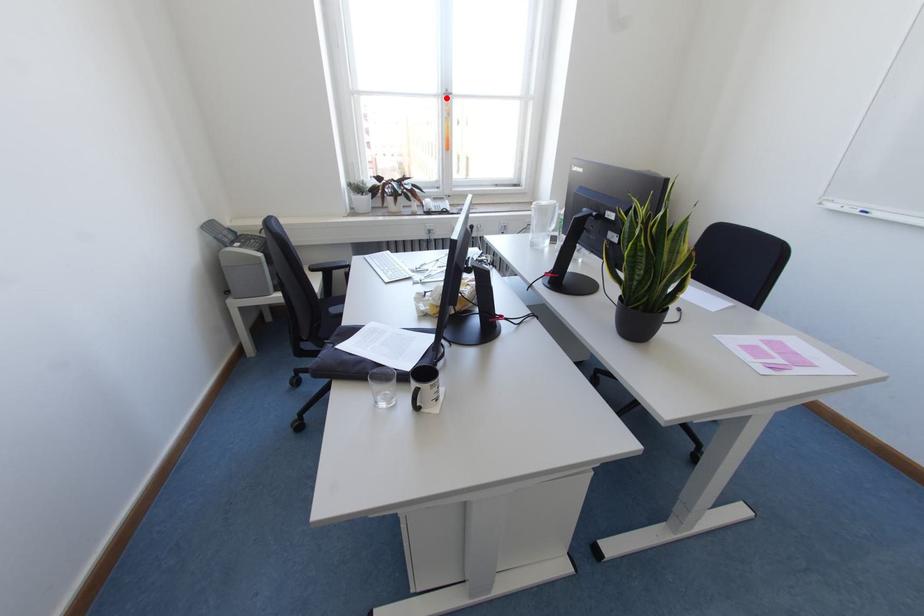
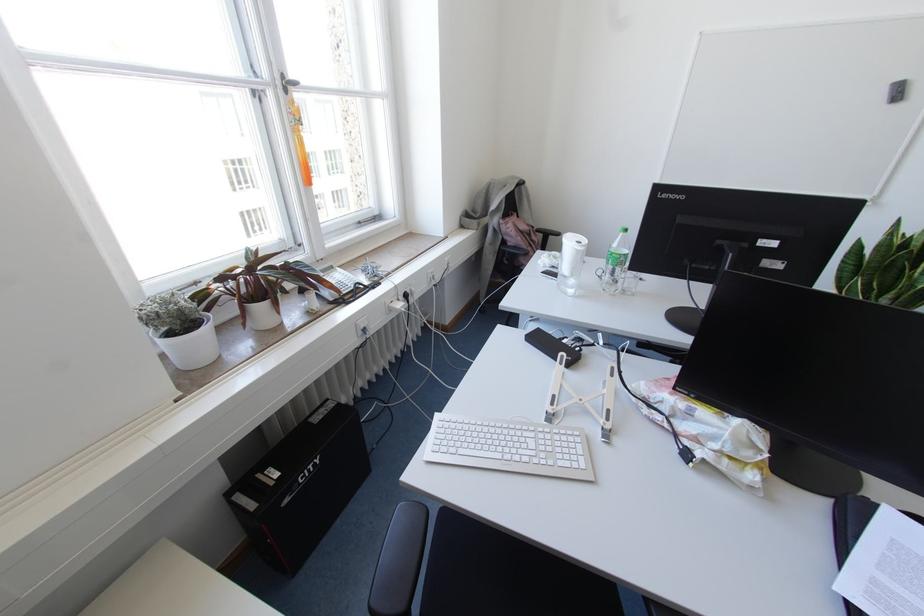
Find the pixel in the second image that matches the highlighted location in the first image.

(285, 90)